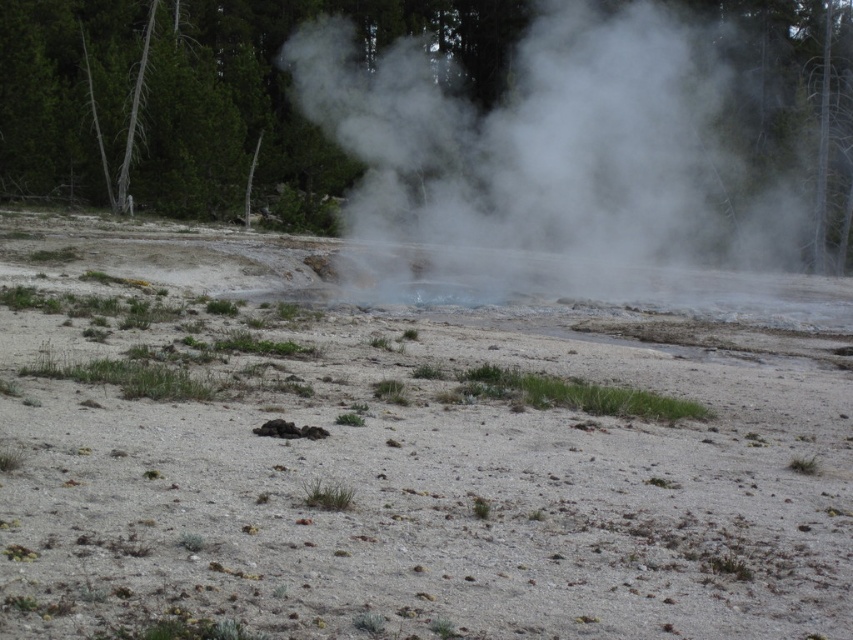
Question: Is gray sandy dirt field at center closer to the viewer compared to white vapor steam at center?

Choices:
 (A) no
 (B) yes

Answer: (B)

Question: Is gray sandy dirt field at center to the right of white vapor steam at center from the viewer's perspective?

Choices:
 (A) no
 (B) yes

Answer: (A)

Question: Which of the following is the closest to the observer?

Choices:
 (A) (496, 272)
 (B) (264, 355)

Answer: (B)

Question: From the image, what is the correct spatial relationship of gray sandy dirt field at center in relation to white vapor steam at center?

Choices:
 (A) above
 (B) below

Answer: (B)